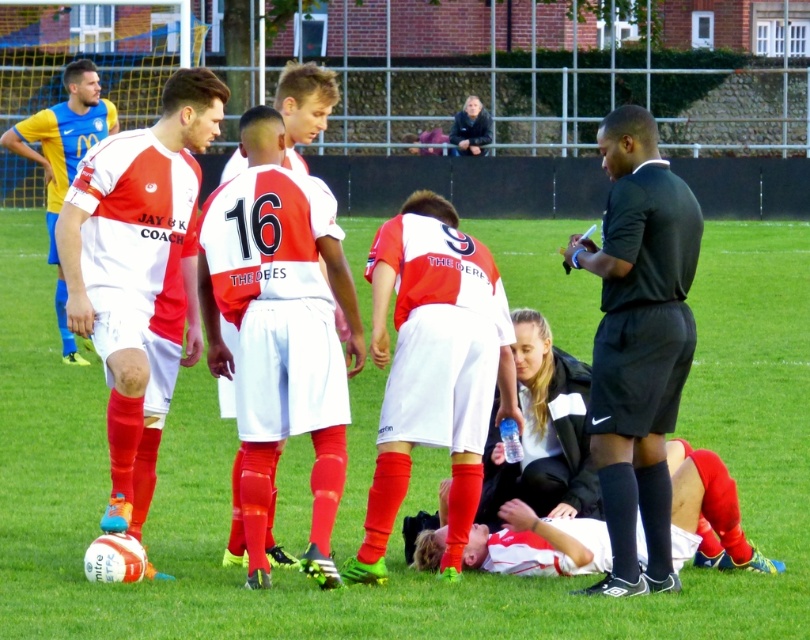
You are a soccer player positioned at the edge of the field. You need to pass the ball to your teammate wearing the black smooth shirt at right without crossing the green grass at center. Is this possible?

The green grass at center is to the left of the black smooth shirt at right, so passing the ball around the right side of the green grass at center would allow you to reach the black smooth shirt at right without crossing it.